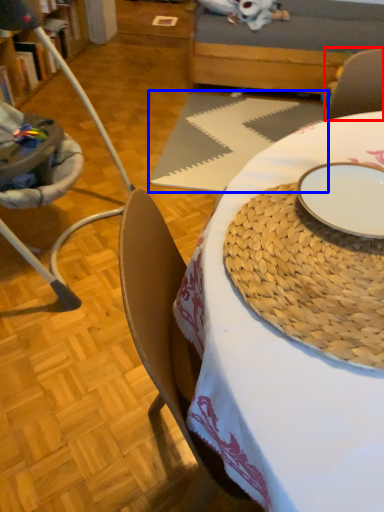
Question: Which of the following is the farthest to the observer, armchair (highlighted by a red box) or tablecloth (highlighted by a blue box)?

Choices:
 (A) armchair
 (B) tablecloth

Answer: (A)